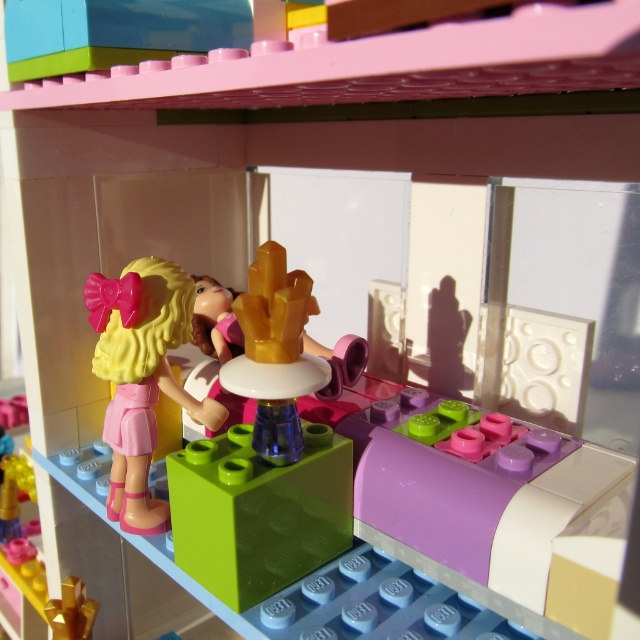
Consider the image. Does translucent green block at center come in front of matte pink plastic doll at left?

Yes, it is.

Is translucent green block at center further to the viewer compared to matte pink plastic doll at left?

No, translucent green block at center is closer to the viewer.

Find the location of a particular element. The height and width of the screenshot is (640, 640). translucent green block at center is located at coordinates (262, 458).